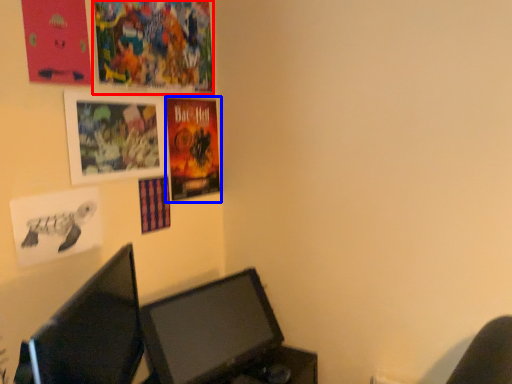
Question: Which of the following is the closest to the observer, poster page (highlighted by a red box) or poster (highlighted by a blue box)?

Choices:
 (A) poster page
 (B) poster

Answer: (A)